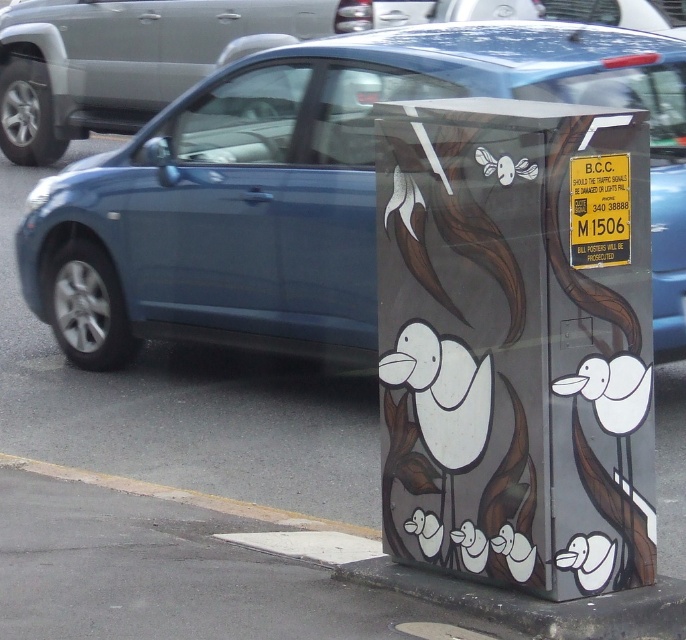
Question: Observing the image, what is the correct spatial positioning of smooth concrete curb at lower left in reference to black plastic license plate at center?

Choices:
 (A) below
 (B) above

Answer: (A)

Question: Which object is positioned closest to the matte glass parking meter at center?

Choices:
 (A) metallic blue sedan at center
 (B) black plastic license plate at center
 (C) smooth concrete curb at lower left

Answer: (B)

Question: Which of the following is the farthest from the observer?

Choices:
 (A) matte glass parking meter at center
 (B) black plastic license plate at center
 (C) smooth concrete curb at lower left

Answer: (C)

Question: Which object is positioned farthest from the matte glass parking meter at center?

Choices:
 (A) metallic blue sedan at center
 (B) metallic blue car at center
 (C) black plastic license plate at center

Answer: (A)

Question: Considering the relative positions of matte glass parking meter at center and smooth concrete curb at lower left in the image provided, where is matte glass parking meter at center located with respect to smooth concrete curb at lower left?

Choices:
 (A) below
 (B) above

Answer: (B)

Question: Is metallic blue car at center wider than smooth concrete curb at lower left?

Choices:
 (A) yes
 (B) no

Answer: (A)